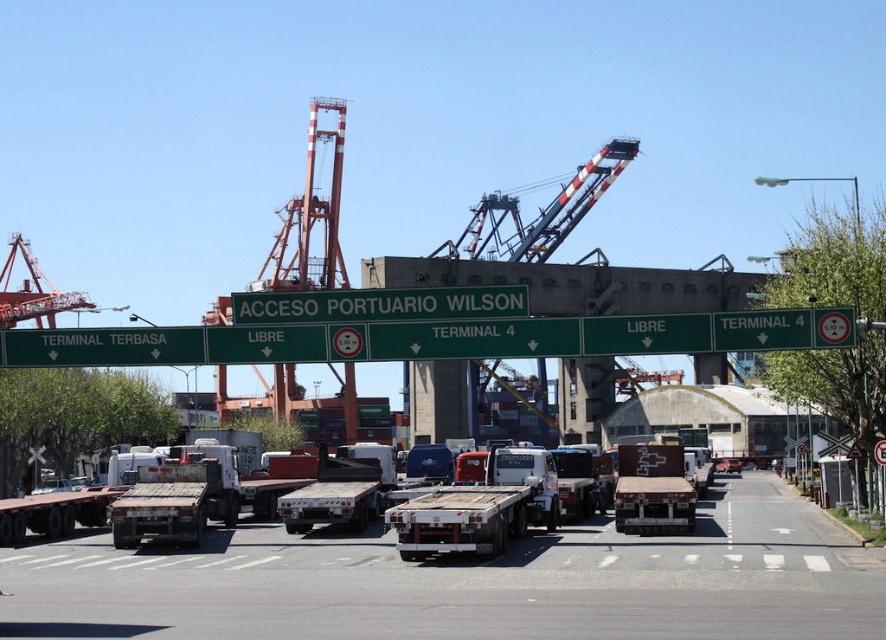
You are a delivery driver who needs to park your vehicle in the port area. You have a metallic flatbed trailer at center and a metallic silver car at center. Which vehicle can you park closer to the green directional signs without blocking the road access?

The metallic silver car at center can be parked closer to the green directional signs without blocking the road access because it is smaller in size compared to the metallic flatbed trailer at center.

You are a delivery driver who needs to unload a container from the metallic flatbed trailer at center onto the white matte truck at center. Based on their positions, can you safely perform this task without needing to move either vehicle?

The white matte truck at center is positioned under the metallic flatbed trailer at center, so the container can be safely unloaded directly from the trailer onto the truck without needing to move either vehicle.

You are a truck driver who needs to pass under a low bridge that has a height restriction of 3 meters. You are currently driving the metallic silver car at center and see the metallic flatbed trailer at center ahead of you. Based on their heights, which vehicle should avoid the bridge to prevent damage?

The metallic flatbed trailer at center has a greater height compared to the metallic silver car at center. Therefore, the metallic flatbed trailer at center should avoid the bridge to prevent damage since it is taller than the 3 meters height restriction.